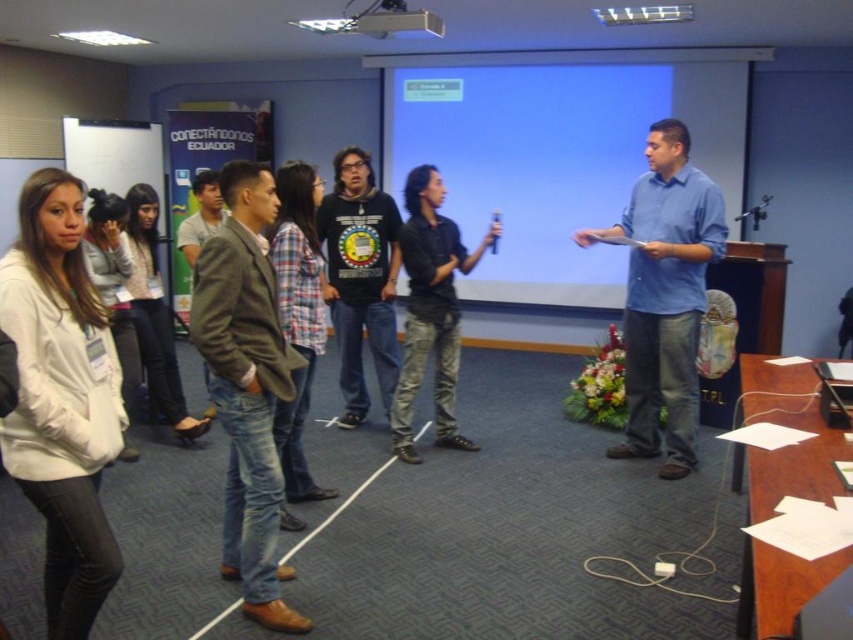
Question: Which point appears closest to the camera in this image?

Choices:
 (A) (524, 236)
 (B) (265, 182)
 (C) (410, 352)

Answer: (B)

Question: Which of the following is the closest to the observer?

Choices:
 (A) dark blue shirt at center
 (B) green textured jacket at center

Answer: (A)

Question: Which object is positioned farthest from the black matte t-shirt at center?

Choices:
 (A) green woolen jacket at center
 (B) blue matte projection screen at center

Answer: (B)

Question: In this image, where is blue cotton shirt at center located relative to black matte t-shirt at center?

Choices:
 (A) left
 (B) right

Answer: (B)

Question: Does dark blue shirt at center have a smaller size compared to metallic projector at upper center?

Choices:
 (A) no
 (B) yes

Answer: (A)

Question: Is black matte t-shirt at center closer to the viewer compared to metallic projector at upper center?

Choices:
 (A) no
 (B) yes

Answer: (A)